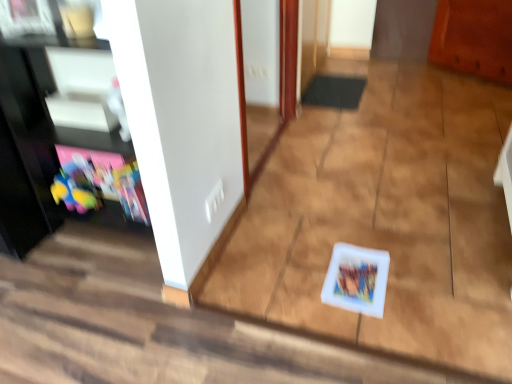
Question: Considering the relative sizes of white glossy door at center and white plastic book at center in the image provided, is white glossy door at center bigger than white plastic book at center?

Choices:
 (A) yes
 (B) no

Answer: (A)

Question: Can you confirm if white glossy door at center is taller than white plastic book at center?

Choices:
 (A) yes
 (B) no

Answer: (A)

Question: Would you say white glossy door at center is outside white plastic book at center?

Choices:
 (A) no
 (B) yes

Answer: (B)

Question: Is white glossy door at center to the right of white plastic book at center from the viewer's perspective?

Choices:
 (A) no
 (B) yes

Answer: (B)

Question: Is white glossy door at center aimed at white plastic book at center?

Choices:
 (A) yes
 (B) no

Answer: (B)

Question: Visually, is matt black shelf at left positioned to the left or to the right of white plastic book at center?

Choices:
 (A) right
 (B) left

Answer: (B)

Question: Considering the positions of matt black shelf at left and white plastic book at center in the image, is matt black shelf at left wider or thinner than white plastic book at center?

Choices:
 (A) thin
 (B) wide

Answer: (A)

Question: Considering the positions of matt black shelf at left and white plastic book at center in the image, is matt black shelf at left bigger or smaller than white plastic book at center?

Choices:
 (A) small
 (B) big

Answer: (A)

Question: Does point (87, 205) appear closer or farther from the camera than point (457, 382)?

Choices:
 (A) farther
 (B) closer

Answer: (A)

Question: Based on their positions, is black glossy entertainment center at left located to the left or right of matt black shelf at left?

Choices:
 (A) right
 (B) left

Answer: (A)

Question: In terms of height, does black glossy entertainment center at left look taller or shorter compared to matt black shelf at left?

Choices:
 (A) tall
 (B) short

Answer: (A)

Question: Considering the positions of point (40, 208) and point (115, 152), is point (40, 208) closer or farther from the camera than point (115, 152)?

Choices:
 (A) closer
 (B) farther

Answer: (B)

Question: From the image's perspective, is black glossy entertainment center at left positioned above or below matt black shelf at left?

Choices:
 (A) above
 (B) below

Answer: (A)

Question: Is black glossy entertainment center at left taller or shorter than white matte card game at center?

Choices:
 (A) short
 (B) tall

Answer: (B)

Question: Is point (52, 178) positioned closer to the camera than point (355, 246)?

Choices:
 (A) closer
 (B) farther

Answer: (B)